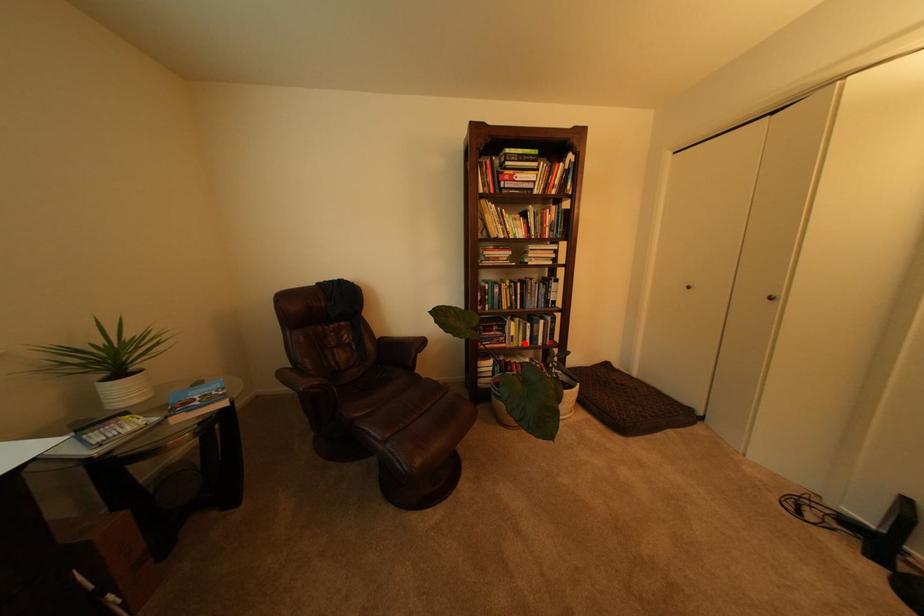
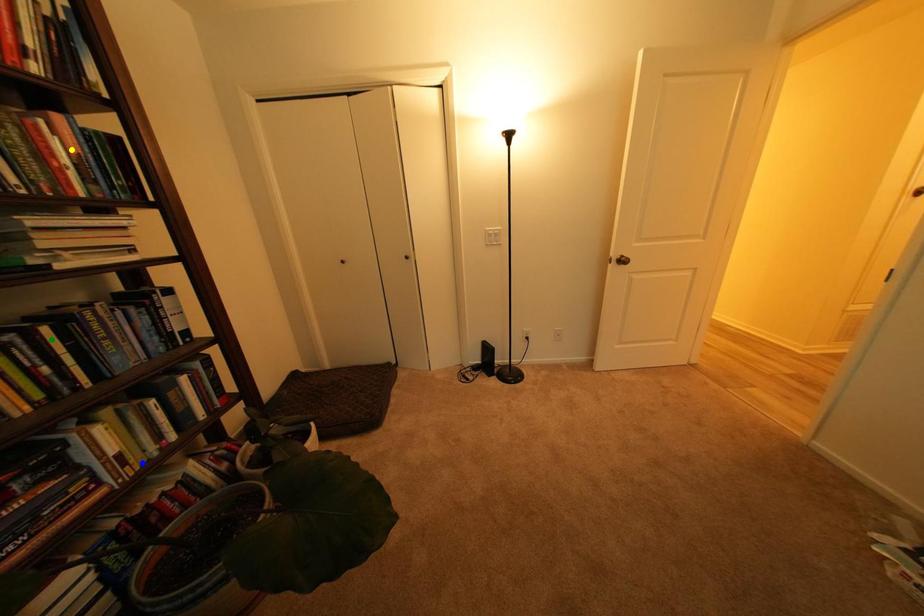
Question: I am providing you with two images of the same scene from different viewpoints. A red point is marked on the first image. You are given multiple points on the second image. Which spot in image 2 lines up with the point in image 1?

Choices:
 (A) green point
 (B) yellow point
 (C) blue point

Answer: (C)